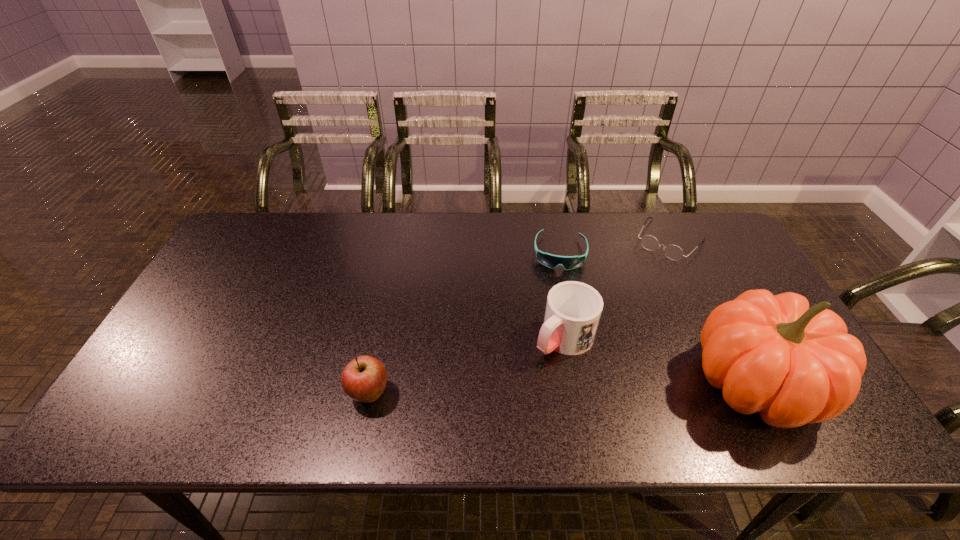
At what (x,y) coordinates should I click in order to perform the action: click on vacant region located on the front-facing side of the sunglasses. Please return your answer as a coordinate pair (x, y). Image resolution: width=960 pixels, height=540 pixels. Looking at the image, I should click on (558, 325).

This screenshot has height=540, width=960. I want to click on free space located on the front-facing side of the sunglasses, so click(x=558, y=311).

I want to click on vacant space situated 0.340m on the front-facing side of the sunglasses, so coord(557,364).

Find the location of a particular element. The image size is (960, 540). free space located on the side of the mug with the handle is located at coordinates (525, 373).

Locate an element on the screen. Image resolution: width=960 pixels, height=540 pixels. blank space located 0.160m on the side of the mug with the handle is located at coordinates (500, 396).

This screenshot has height=540, width=960. In order to click on vacant space located 0.080m on the side of the mug with the handle in this screenshot , I will do `click(523, 375)`.

The width and height of the screenshot is (960, 540). I want to click on spectacles located at the far edge, so click(x=673, y=252).

The image size is (960, 540). I want to click on sunglasses situated at the far edge, so click(x=551, y=261).

Identify the location of apple present at the near edge. This screenshot has width=960, height=540. (363, 379).

At what (x,y) coordinates should I click in order to perform the action: click on pumpkin that is positioned at the near edge. Please return your answer as a coordinate pair (x, y). The image size is (960, 540). Looking at the image, I should click on (772, 354).